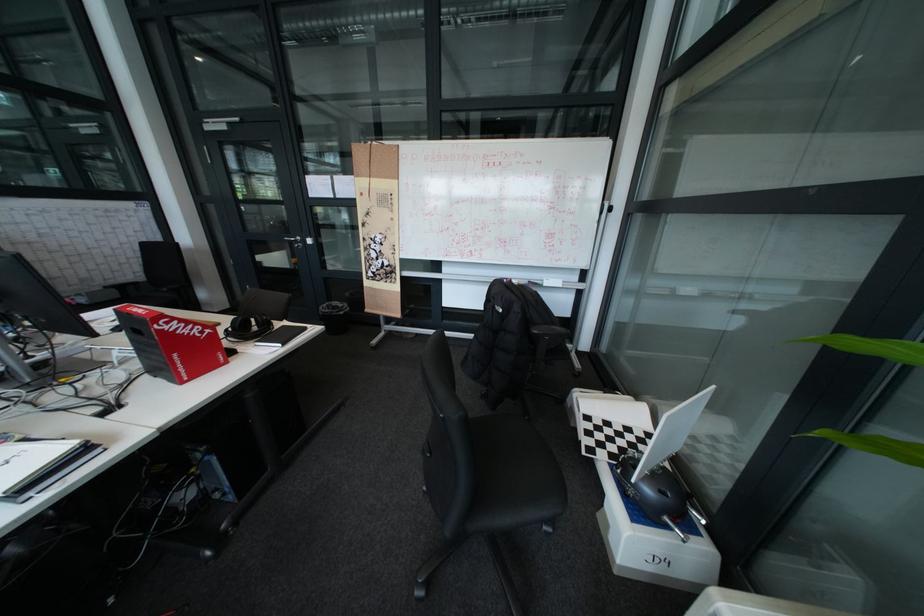
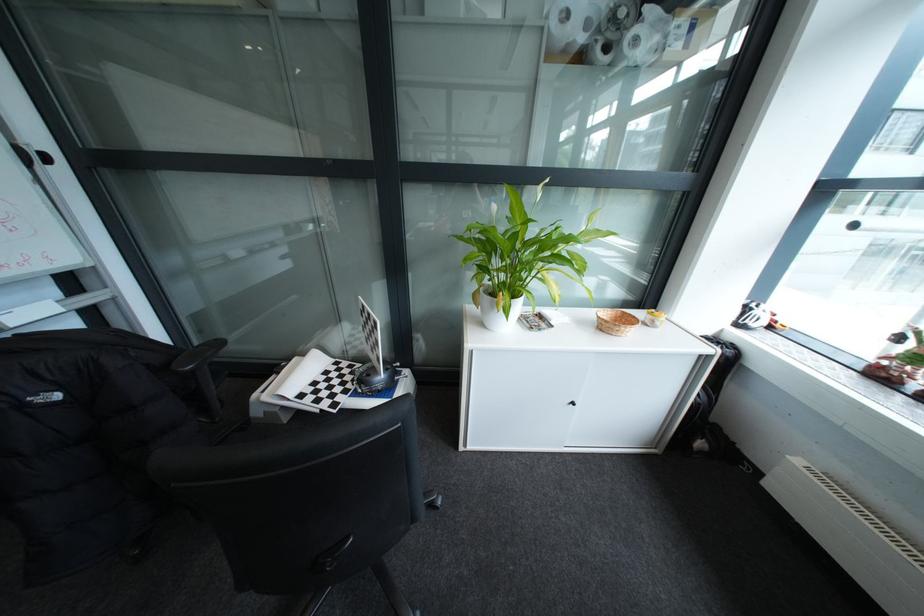
In the second image, find the point that corresponds to pixel 614 424 in the first image.

(325, 389)